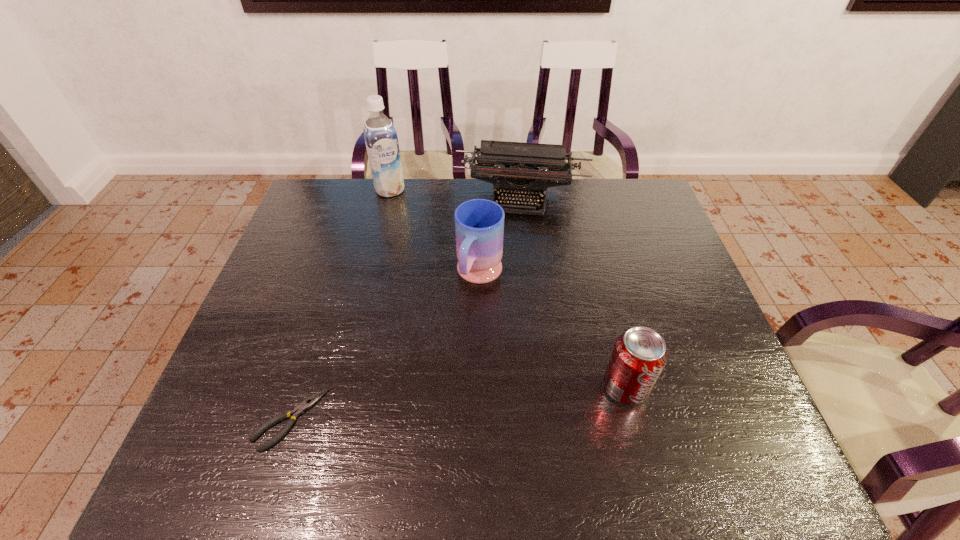
I want to click on blank space located on the side of the mug with the handle, so click(x=410, y=424).

You are a GUI agent. You are given a task and a screenshot of the screen. Output one action in this format:
    pyautogui.click(x=<x>, y=<y>)
    Task: Click on the vacant space located 0.290m on the side of the mug with the handle
    This screenshot has width=960, height=540.
    Given the screenshot: What is the action you would take?
    pyautogui.click(x=424, y=395)

The image size is (960, 540). Identify the location of free space located 0.140m on the side of the mug with the handle. (451, 341).

You are a GUI agent. You are given a task and a screenshot of the screen. Output one action in this format:
    pyautogui.click(x=<x>, y=<y>)
    Task: Click on the vacant position located on the typing side of the typewriter
    This screenshot has width=960, height=540.
    Given the screenshot: What is the action you would take?
    pyautogui.click(x=503, y=295)

I want to click on vacant space located on the typing side of the typewriter, so click(507, 265).

Locate an element on the screen. The height and width of the screenshot is (540, 960). blank space located 0.130m on the typing side of the typewriter is located at coordinates (510, 246).

Locate an element on the screen. The height and width of the screenshot is (540, 960). soya milk located at the far edge is located at coordinates (381, 139).

Where is `typewriter that is at the far edge`? The height and width of the screenshot is (540, 960). typewriter that is at the far edge is located at coordinates (510, 166).

In order to click on pliers that is at the near edge in this screenshot , I will do `click(299, 410)`.

Locate an element on the screen. Image resolution: width=960 pixels, height=540 pixels. soda can that is at the near edge is located at coordinates pyautogui.click(x=639, y=356).